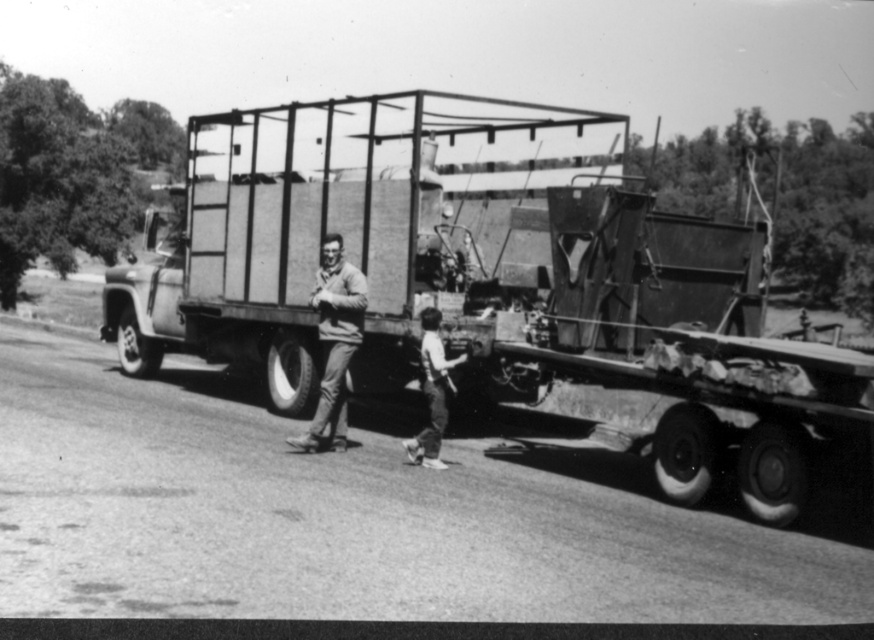
Can you confirm if smooth beige sweater at center is wider than light brown hair at lower center?

Yes.

What do you see at coordinates (334, 340) in the screenshot? I see `smooth beige sweater at center` at bounding box center [334, 340].

Does point (324, 365) lie in front of point (445, 371)?

No.

Find the location of a particular element. smooth beige sweater at center is located at coordinates [x=334, y=340].

Who is positioned more to the left, metallic flatbed truck at center or smooth beige sweater at center?

smooth beige sweater at center is more to the left.

Who is more forward, (350,243) or (296,444)?

Point (296,444) is in front.

Find the location of a particular element. The image size is (874, 640). metallic flatbed truck at center is located at coordinates (498, 285).

I want to click on metallic flatbed truck at center, so click(x=498, y=285).

Can you confirm if metallic flatbed truck at center is positioned to the left of light brown hair at lower center?

In fact, metallic flatbed truck at center is to the right of light brown hair at lower center.

Describe the element at coordinates (498, 285) in the screenshot. The height and width of the screenshot is (640, 874). I see `metallic flatbed truck at center` at that location.

Is point (796, 340) positioned after point (425, 355)?

No, it is not.

Identify the location of metallic flatbed truck at center. Image resolution: width=874 pixels, height=640 pixels. (498, 285).